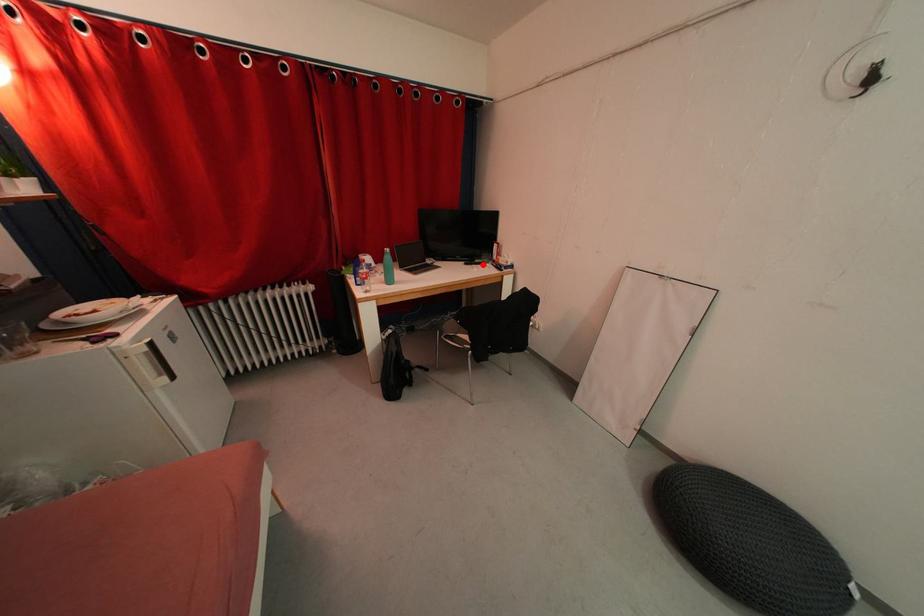
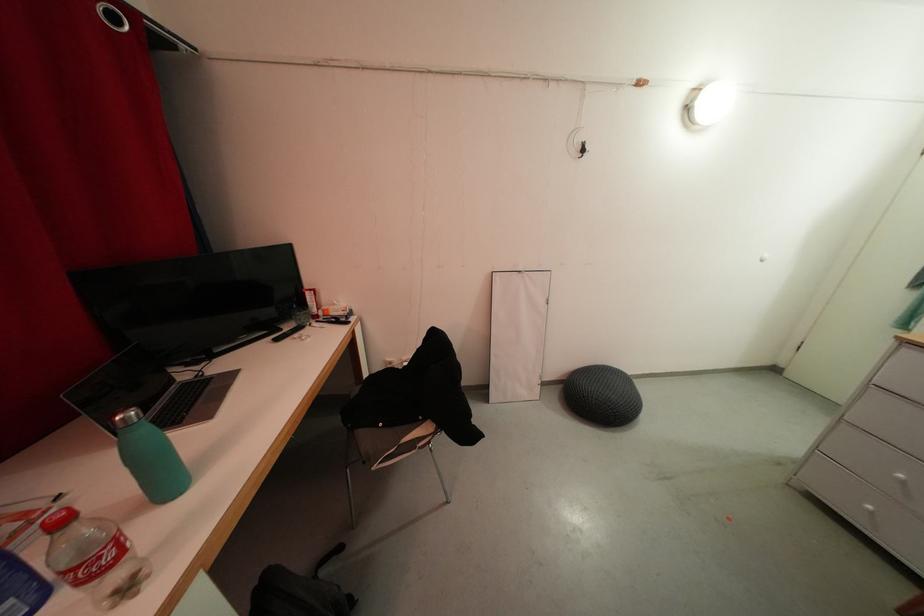
The point at the highlighted location is marked in the first image. Where is the corresponding point in the second image?

(293, 331)